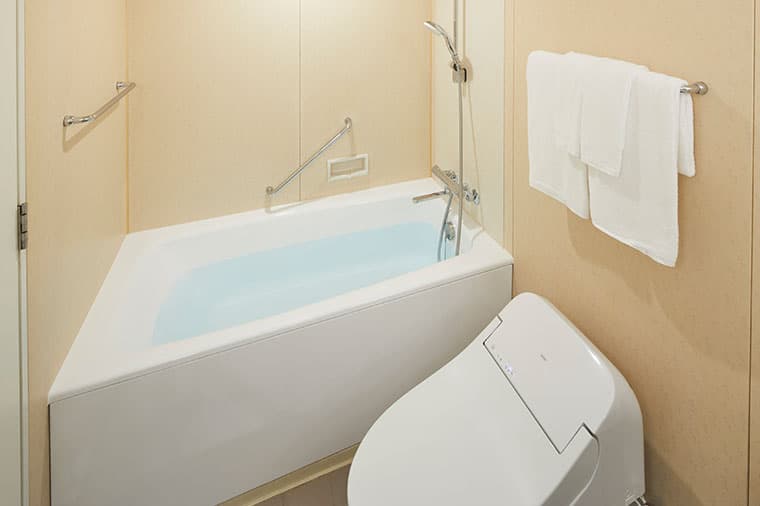
Identify the location of faucet. The height and width of the screenshot is (506, 760). (437, 193).